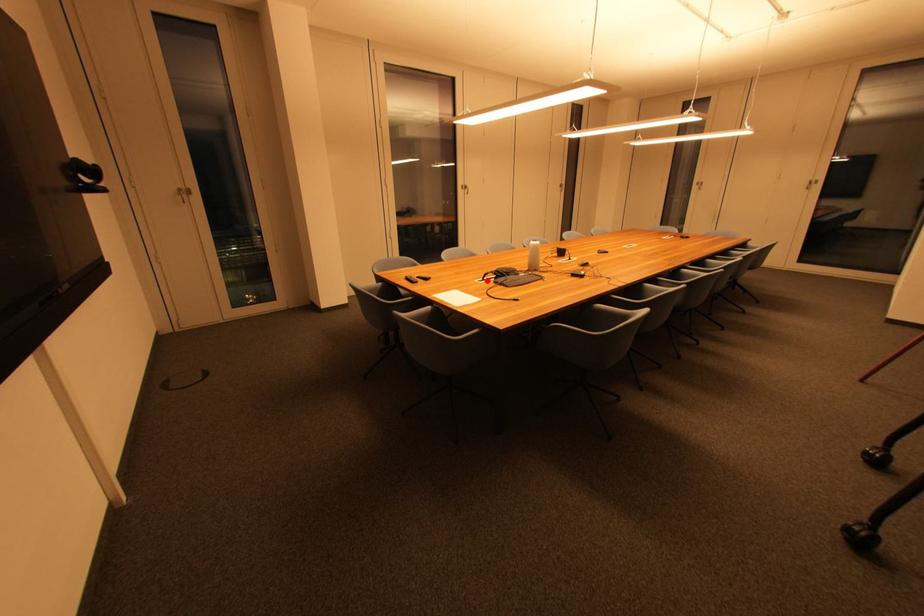
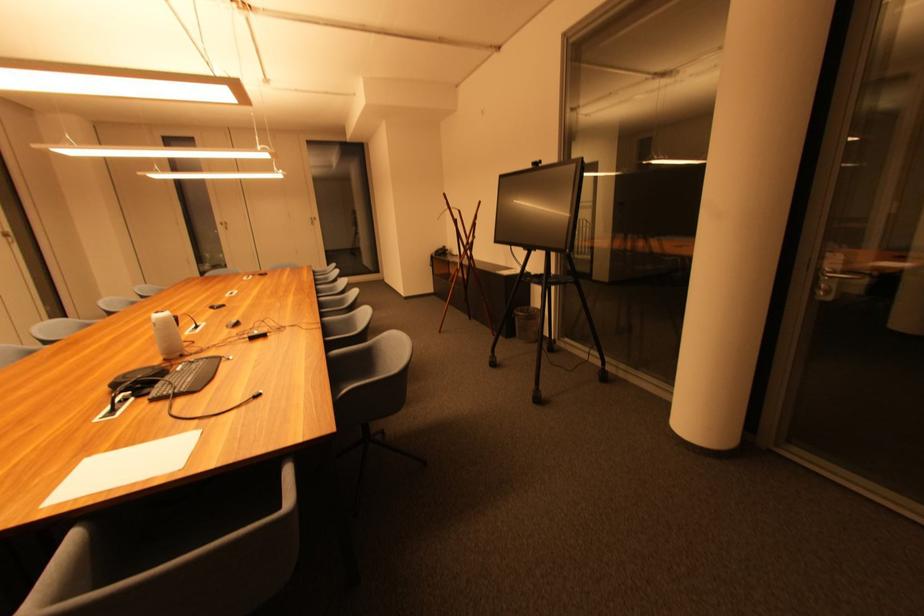
The point at the highlighted location is marked in the first image. Where is the corresponding point in the second image?

(114, 411)